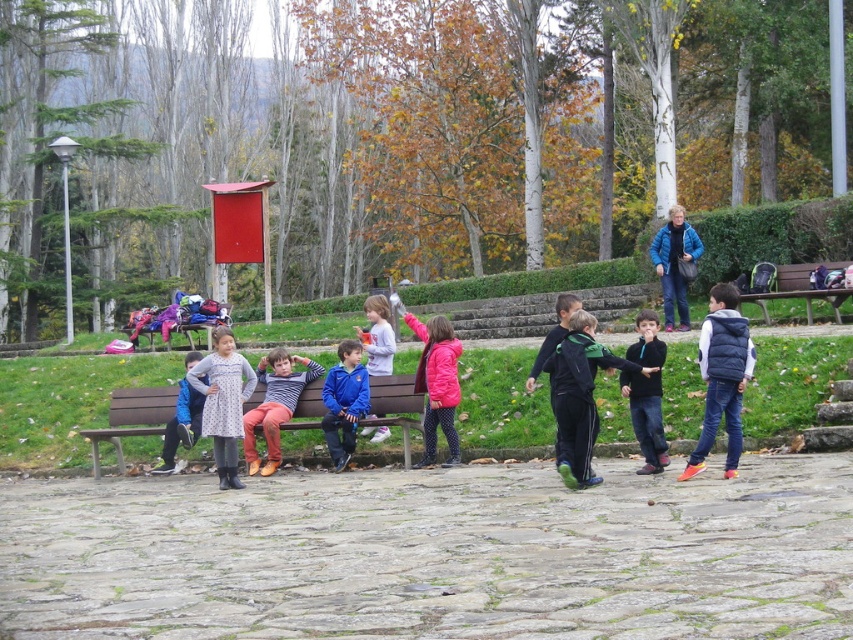
Question: Does green athletic tracksuit at center lie in front of patterned fabric dress at left?

Choices:
 (A) no
 (B) yes

Answer: (B)

Question: Based on their relative distances, which object is farther from the blue fleece jacket at center?

Choices:
 (A) wooden bench at center
 (B) black fleece jacket at center
 (C) wooden bench at right
 (D) striped cotton shirt at center

Answer: (A)

Question: Which point is farther from the camera taking this photo?

Choices:
 (A) (576, 420)
 (B) (355, 326)
 (C) (642, 436)

Answer: (B)

Question: Where is blue softshell jacket at upper right located in relation to blue fabric jacket at center in the image?

Choices:
 (A) above
 (B) below

Answer: (A)

Question: Which object appears closest to the camera in this image?

Choices:
 (A) patterned fabric dress at left
 (B) blue fabric jacket at center
 (C) black fleece jacket at center

Answer: (C)

Question: Is blue softshell jacket at upper right further to the viewer compared to pink fabric dress at center?

Choices:
 (A) yes
 (B) no

Answer: (A)